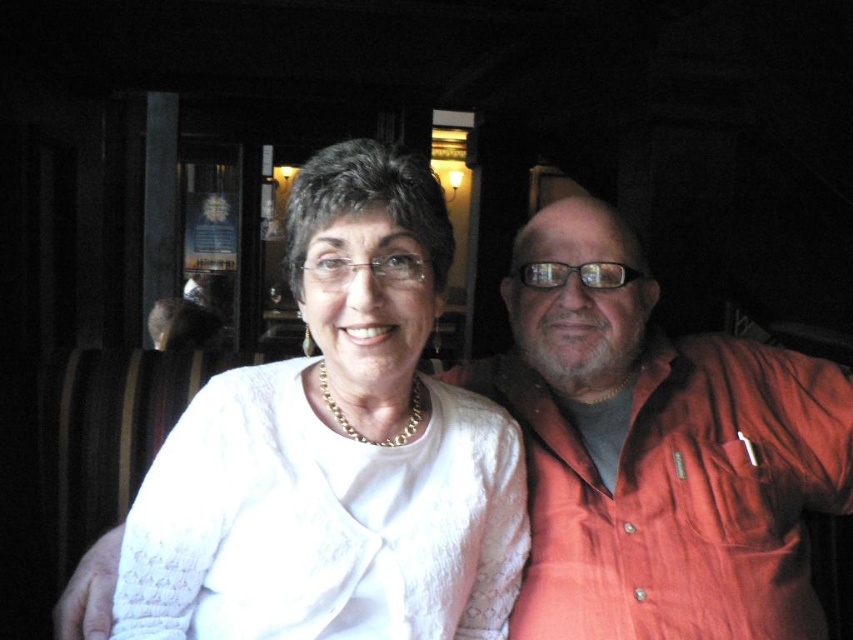
From the picture: Measure the distance from white textured blouse at center to matte orange shirt at center.

They are 12.28 inches apart.

Based on the photo, who is higher up, white textured blouse at center or matte orange shirt at center?

Positioned higher is white textured blouse at center.

Which is in front, point (325, 568) or point (688, 420)?

Positioned in front is point (325, 568).

In order to click on white textured blouse at center in this screenshot , I will do `click(335, 451)`.